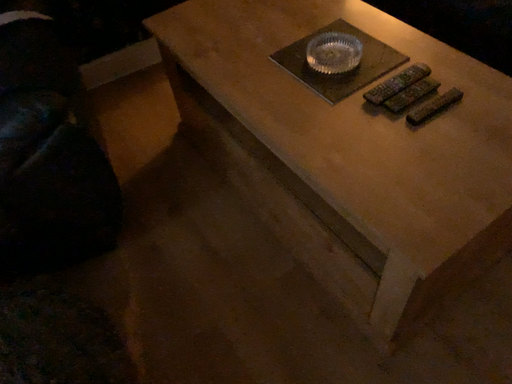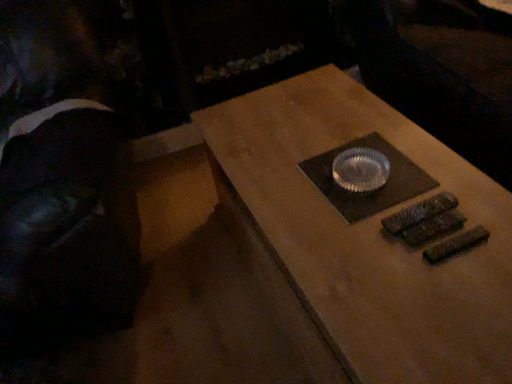
Question: How did the camera likely rotate when shooting the video?

Choices:
 (A) rotated left
 (B) rotated right

Answer: (A)